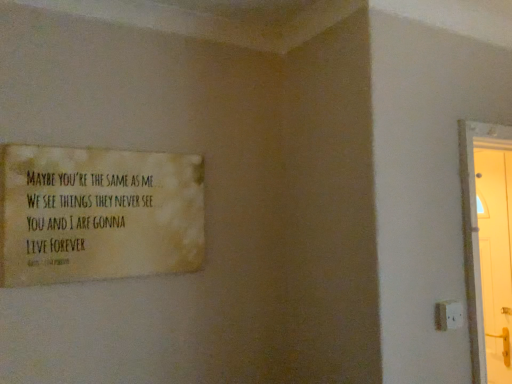
Question: Based on their positions, is white plastic electric outlet at lower right located to the left or right of matte yellow poster at upper left?

Choices:
 (A) left
 (B) right

Answer: (B)

Question: Looking at their shapes, would you say white plastic electric outlet at lower right is wider or thinner than matte yellow poster at upper left?

Choices:
 (A) wide
 (B) thin

Answer: (B)

Question: From a real-world perspective, is white plastic electric outlet at lower right positioned above or below matte yellow poster at upper left?

Choices:
 (A) above
 (B) below

Answer: (B)

Question: Considering their positions, is matte yellow poster at upper left located in front of or behind white plastic electric outlet at lower right?

Choices:
 (A) front
 (B) behind

Answer: (A)

Question: From their relative heights in the image, would you say matte yellow poster at upper left is taller or shorter than white plastic electric outlet at lower right?

Choices:
 (A) short
 (B) tall

Answer: (B)

Question: From the image's perspective, is matte yellow poster at upper left above or below white plastic electric outlet at lower right?

Choices:
 (A) above
 (B) below

Answer: (A)

Question: Is matte yellow poster at upper left bigger or smaller than white plastic electric outlet at lower right?

Choices:
 (A) small
 (B) big

Answer: (B)